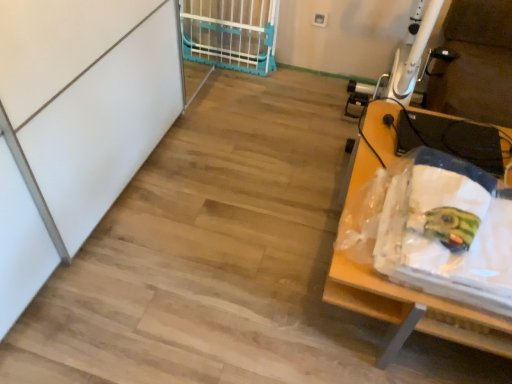
Question: Is blue plastic gate at upper center closer to the viewer compared to wooden table at right?

Choices:
 (A) yes
 (B) no

Answer: (B)

Question: Is blue plastic gate at upper center not inside wooden table at right?

Choices:
 (A) yes
 (B) no

Answer: (A)

Question: Is blue plastic gate at upper center looking in the opposite direction of wooden table at right?

Choices:
 (A) yes
 (B) no

Answer: (B)

Question: Is blue plastic gate at upper center at the right side of wooden table at right?

Choices:
 (A) yes
 (B) no

Answer: (B)

Question: Does blue plastic gate at upper center have a lesser width compared to wooden table at right?

Choices:
 (A) no
 (B) yes

Answer: (B)

Question: From the image's perspective, is blue plastic gate at upper center on wooden table at right?

Choices:
 (A) no
 (B) yes

Answer: (B)

Question: Is wooden table at right next to blue plastic gate at upper center?

Choices:
 (A) no
 (B) yes

Answer: (A)

Question: From the image's perspective, is wooden table at right under blue plastic gate at upper center?

Choices:
 (A) yes
 (B) no

Answer: (A)

Question: Is wooden table at right looking in the opposite direction of blue plastic gate at upper center?

Choices:
 (A) no
 (B) yes

Answer: (A)

Question: Is wooden table at right at the left side of blue plastic gate at upper center?

Choices:
 (A) no
 (B) yes

Answer: (A)

Question: Is the position of wooden table at right more distant than that of blue plastic gate at upper center?

Choices:
 (A) no
 (B) yes

Answer: (A)

Question: Does wooden table at right appear on the right side of blue plastic gate at upper center?

Choices:
 (A) yes
 (B) no

Answer: (A)

Question: Based on their sizes in the image, would you say blue plastic gate at upper center is bigger or smaller than wooden table at right?

Choices:
 (A) big
 (B) small

Answer: (B)